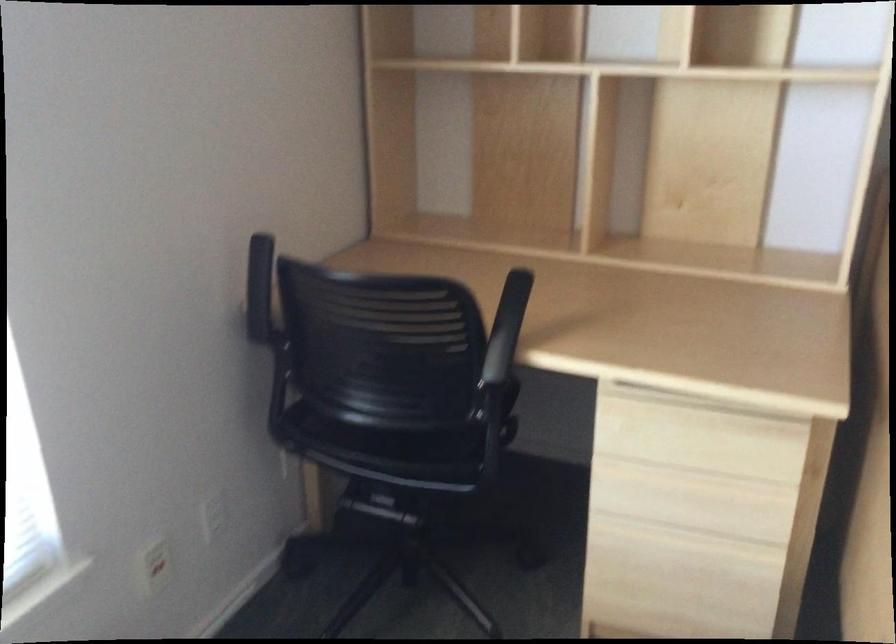
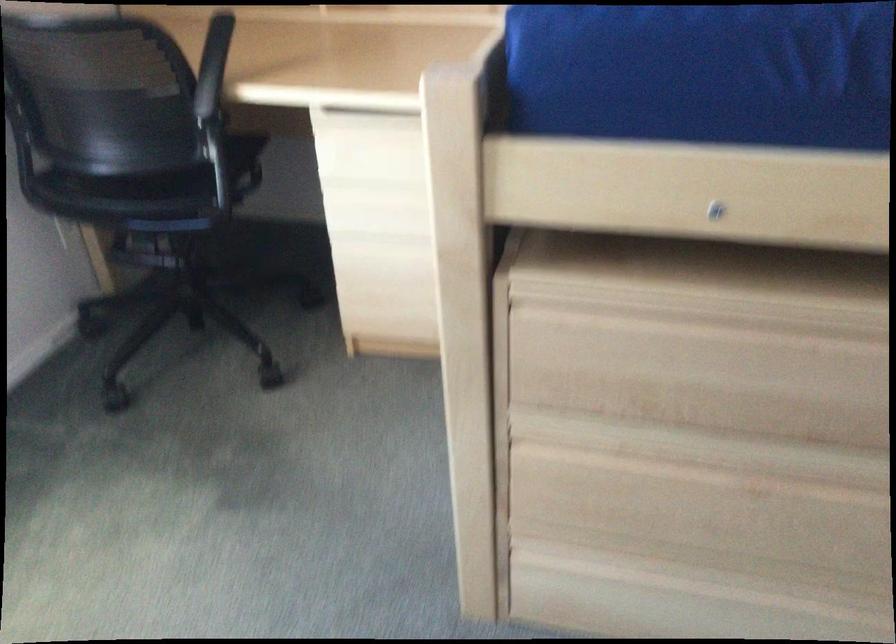
Consider the image. The images are taken continuously from a first-person perspective. In which direction are you moving?

The movement direction of the cameraman is right, backward.